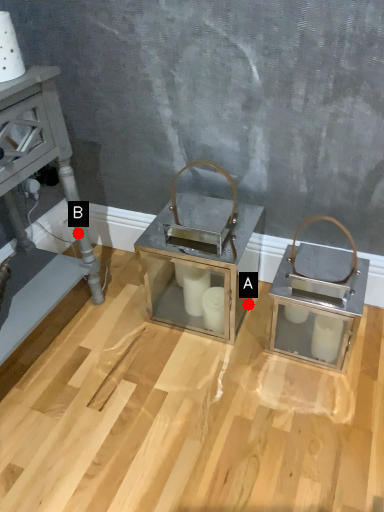
Question: Two points are circled on the image, labeled by A and B beside each circle. Which point is closer to the camera?

Choices:
 (A) A is closer
 (B) B is closer

Answer: (B)